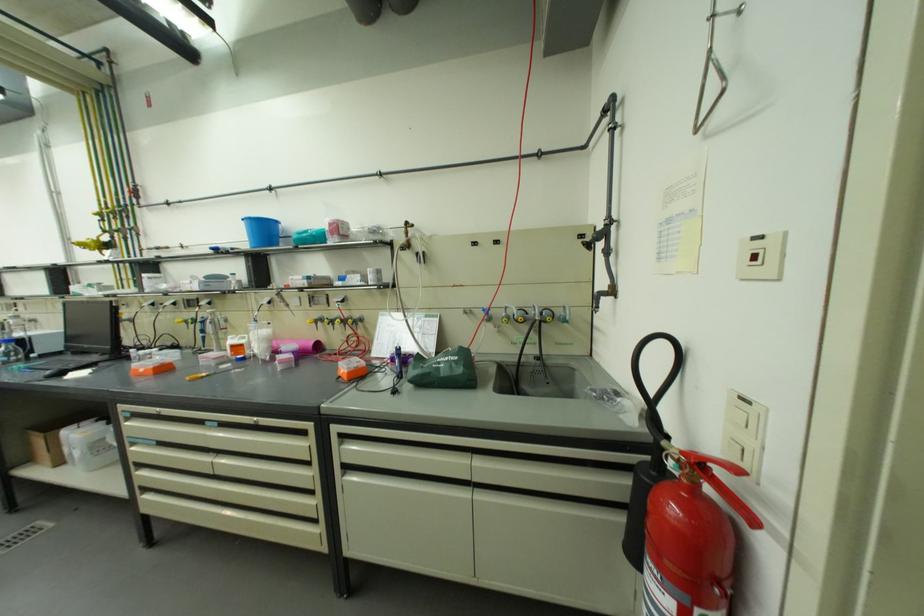
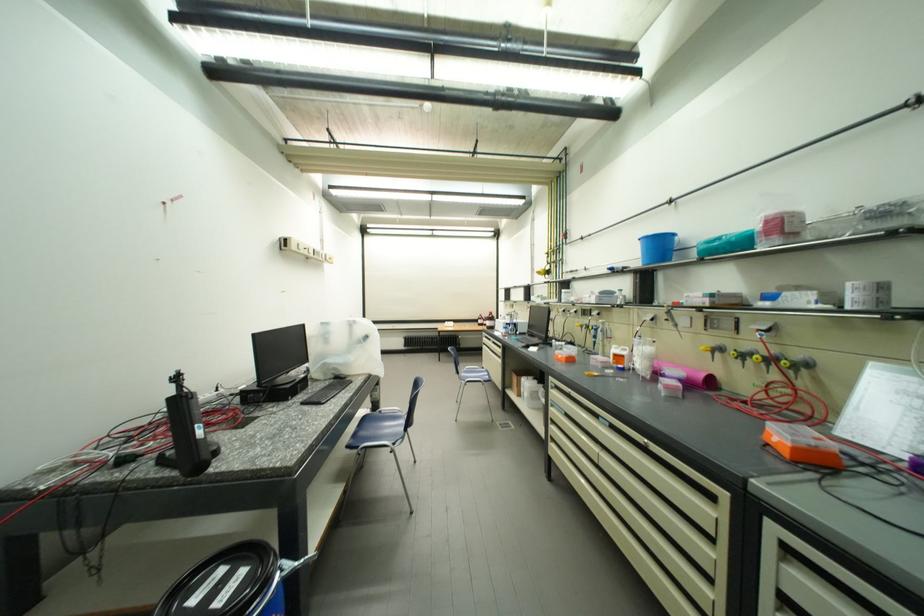
Locate, in the second image, the point that corresponds to point 363,369 in the first image.

(820, 447)